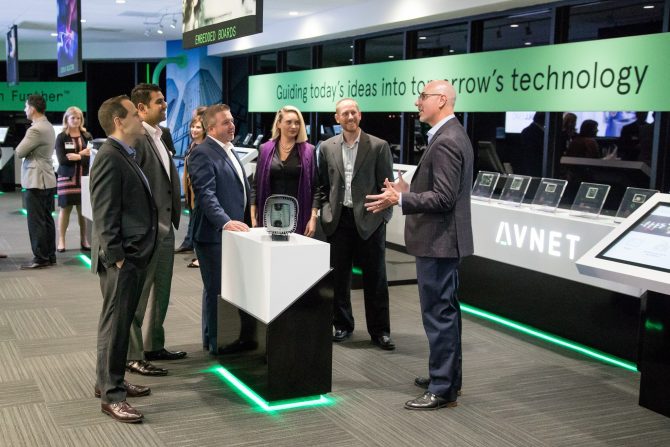
I want to click on screen, so click(x=614, y=131).